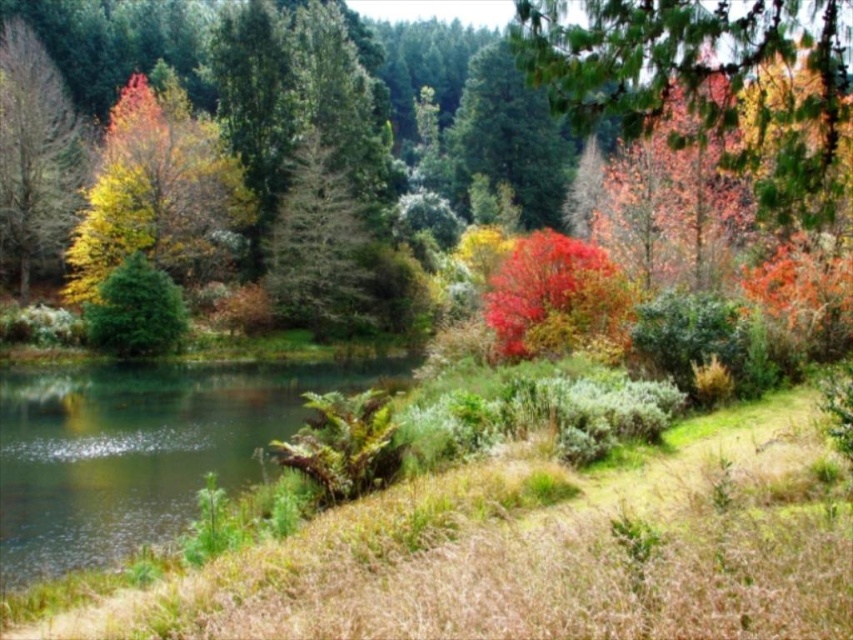
Which is behind, point (16, 182) or point (318, 195)?

The point (318, 195) is behind.

Does point (30, 44) come closer to viewer compared to point (326, 292)?

No, (30, 44) is behind (326, 292).

Who is more distant from viewer, (20, 102) or (320, 259)?

The point (320, 259) is more distant.

Find the location of a particular element. yellow matte tree at left is located at coordinates (35, 150).

Does clear water at lower left have a lesser height compared to green matte tree at center?

Yes, clear water at lower left is shorter than green matte tree at center.

Who is positioned more to the left, clear water at lower left or green matte tree at center?

clear water at lower left is more to the left.

Between point (0, 449) and point (352, 282), which one is positioned behind?

The point (352, 282) is more distant.

The image size is (853, 640). Identify the location of clear water at lower left. (138, 449).

Is yellow-green foliage at left positioned in front of green matte tree at center?

Yes, it is in front of green matte tree at center.

Can you confirm if yellow-green foliage at left is positioned below green matte tree at center?

Incorrect, yellow-green foliage at left is not positioned below green matte tree at center.

Is point (234, 177) positioned after point (288, 195)?

That is False.

At what (x,y) coordinates should I click in order to perform the action: click on yellow-green foliage at left. Please return your answer as a coordinate pair (x, y). This screenshot has width=853, height=640. Looking at the image, I should click on (155, 189).